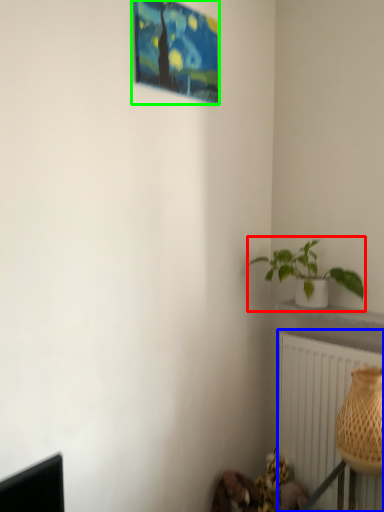
Question: Based on their relative distances, which object is farther from houseplant (highlighted by a red box)? Choose from radiator (highlighted by a blue box) and picture frame (highlighted by a green box).

Choices:
 (A) radiator
 (B) picture frame

Answer: (B)